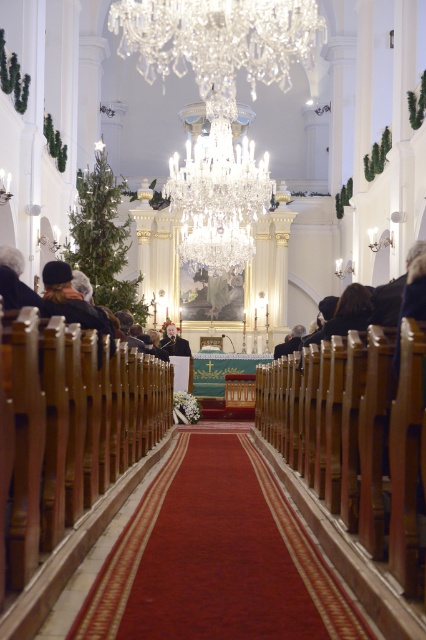
Between carpeted aisle at center and crystal glass chandelier at upper center, which one appears on the right side from the viewer's perspective?

From the viewer's perspective, crystal glass chandelier at upper center appears more on the right side.

Does carpeted aisle at center appear over crystal glass chandelier at upper center?

Incorrect, carpeted aisle at center is not positioned above crystal glass chandelier at upper center.

Is point (71, 596) more distant than point (155, 64)?

No, it is in front of (155, 64).

The height and width of the screenshot is (640, 426). Find the location of `carpeted aisle at center`. carpeted aisle at center is located at coordinates (207, 557).

Can you confirm if carpeted aisle at center is positioned below smooth black jacket at center?

Indeed, carpeted aisle at center is positioned under smooth black jacket at center.

Is point (265, 536) in front of point (166, 337)?

Yes, point (265, 536) is in front of point (166, 337).

The height and width of the screenshot is (640, 426). I want to click on carpeted aisle at center, so click(x=207, y=557).

Does carpeted aisle at center come behind dark brown leather jacket at left?

No, carpeted aisle at center is in front of dark brown leather jacket at left.

Where is `carpeted aisle at center`? carpeted aisle at center is located at coordinates (207, 557).

Is point (104, 604) in front of point (20, 307)?

Yes.

Where is `carpeted aisle at center`? The image size is (426, 640). carpeted aisle at center is located at coordinates (207, 557).